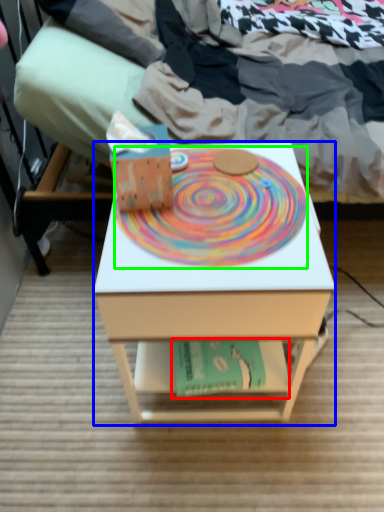
Question: Which object is positioned closest to paperback book (highlighted by a red box)? Select from desk (highlighted by a blue box) and mandala (highlighted by a green box).

Choices:
 (A) desk
 (B) mandala

Answer: (A)